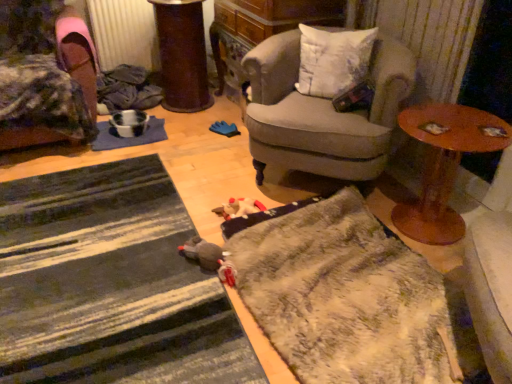
Question: Does fuzzy gray doormat at lower center, positioned as the 1th doormat in right-to-left order, have a larger size compared to gray fabric armchair at center, arranged as the first chair when viewed from the right?

Choices:
 (A) no
 (B) yes

Answer: (A)

Question: From a real-world perspective, does fuzzy gray doormat at lower center, which appears as the 2th doormat when viewed from the left, stand above gray fabric armchair at center, arranged as the 2th chair when viewed from the left?

Choices:
 (A) no
 (B) yes

Answer: (A)

Question: Does fuzzy gray doormat at lower center, positioned as the 1th doormat in right-to-left order, come behind gray fabric armchair at center, arranged as the 2th chair when viewed from the left?

Choices:
 (A) yes
 (B) no

Answer: (B)

Question: Is fuzzy gray doormat at lower center, which appears as the 2th doormat when viewed from the left, touching gray fabric armchair at center, arranged as the 2th chair when viewed from the left?

Choices:
 (A) no
 (B) yes

Answer: (A)

Question: From the image's perspective, is fuzzy gray doormat at lower center, positioned as the 1th doormat in right-to-left order, on top of gray fabric armchair at center, arranged as the first chair when viewed from the right?

Choices:
 (A) no
 (B) yes

Answer: (A)

Question: In the image, is white soft cushion at upper right on the left side or the right side of wooden round table at right?

Choices:
 (A) left
 (B) right

Answer: (A)

Question: Considering the positions of white soft cushion at upper right and wooden round table at right in the image, is white soft cushion at upper right taller or shorter than wooden round table at right?

Choices:
 (A) tall
 (B) short

Answer: (B)

Question: Which is correct: white soft cushion at upper right is inside wooden round table at right, or outside of it?

Choices:
 (A) outside
 (B) inside

Answer: (A)

Question: Considering the positions of point (354, 49) and point (452, 230), is point (354, 49) closer or farther from the camera than point (452, 230)?

Choices:
 (A) farther
 (B) closer

Answer: (A)

Question: Looking at their shapes, would you say white soft cushion at upper right is wider or thinner than blue fabric mat at center-left?

Choices:
 (A) thin
 (B) wide

Answer: (A)

Question: Considering the positions of white soft cushion at upper right and blue fabric mat at center-left in the image, is white soft cushion at upper right taller or shorter than blue fabric mat at center-left?

Choices:
 (A) tall
 (B) short

Answer: (A)

Question: Is white soft cushion at upper right in front of or behind blue fabric mat at center-left in the image?

Choices:
 (A) behind
 (B) front

Answer: (B)

Question: From the image's perspective, relative to blue fabric mat at center-left, is white soft cushion at upper right above or below?

Choices:
 (A) above
 (B) below

Answer: (A)

Question: In terms of width, does gray fabric armchair at center, arranged as the first chair when viewed from the right, look wider or thinner when compared to white soft cushion at upper right?

Choices:
 (A) thin
 (B) wide

Answer: (B)

Question: Considering the positions of point (283, 112) and point (330, 96), is point (283, 112) closer or farther from the camera than point (330, 96)?

Choices:
 (A) closer
 (B) farther

Answer: (A)